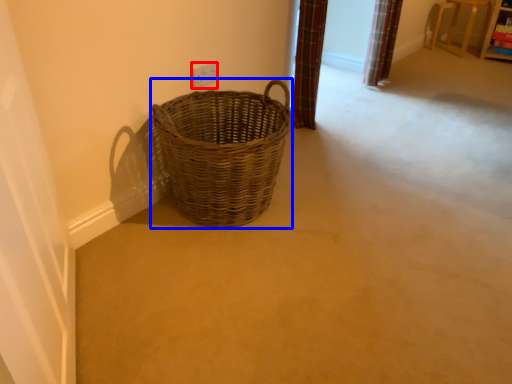
Question: Which of the following is the closest to the observer, electric outlet (highlighted by a red box) or picnic basket (highlighted by a blue box)?

Choices:
 (A) electric outlet
 (B) picnic basket

Answer: (B)